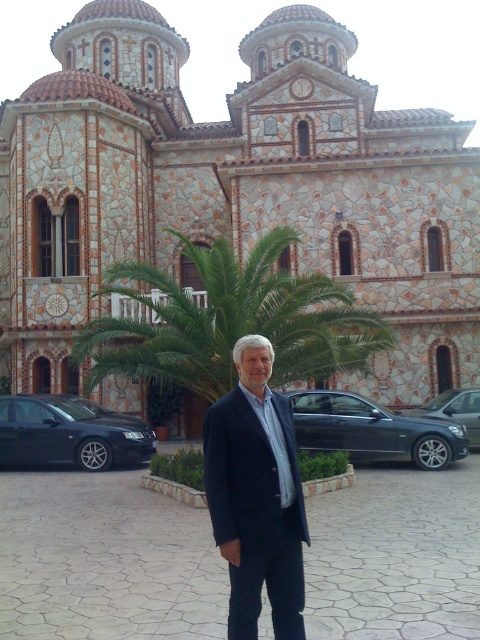
Is stone mosaic church at center shorter than dark blue suit at center?

Incorrect, stone mosaic church at center's height does not fall short of dark blue suit at center's.

Locate an element on the screen. The image size is (480, 640). stone mosaic church at center is located at coordinates (233, 188).

Is point (119, 168) farther from viewer compared to point (249, 352)?

Yes, point (119, 168) is farther from viewer.

At what (x,y) coordinates should I click in order to perform the action: click on stone mosaic church at center. Please return your answer as a coordinate pair (x, y). The image size is (480, 640). Looking at the image, I should click on (233, 188).

Which is above, stone mosaic church at center or green leafy palm tree at center?

Positioned higher is stone mosaic church at center.

Can you confirm if stone mosaic church at center is taller than green leafy palm tree at center?

Correct, stone mosaic church at center is much taller as green leafy palm tree at center.

Describe the element at coordinates (233, 188) in the screenshot. I see `stone mosaic church at center` at that location.

I want to click on stone mosaic church at center, so click(233, 188).

Is dark blue suit at center further to camera compared to satin black sedan at center?

No, dark blue suit at center is in front of satin black sedan at center.

Can you confirm if dark blue suit at center is smaller than satin black sedan at center?

Actually, dark blue suit at center might be larger than satin black sedan at center.

Where is `dark blue suit at center`? The height and width of the screenshot is (640, 480). dark blue suit at center is located at coordinates (256, 496).